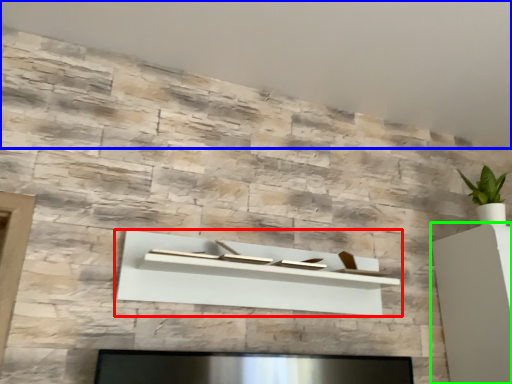
Question: Which object is positioned closest to shelf (highlighted by a red box)? Select from backdrop (highlighted by a blue box) and furniture (highlighted by a green box).

Choices:
 (A) backdrop
 (B) furniture

Answer: (B)